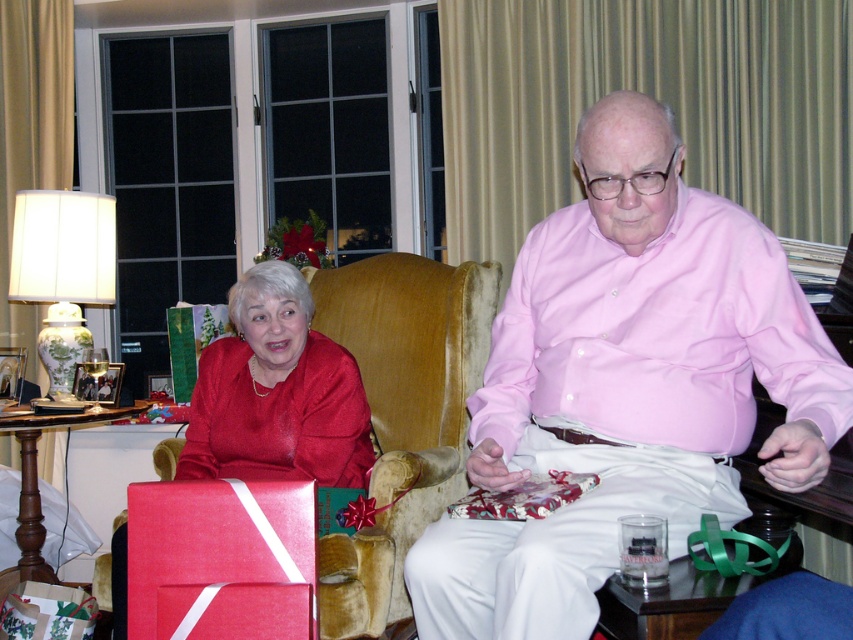
You are standing in the living room and want to place a small decoration between the two points labeled point (x=515, y=316) and point (x=341, y=352). Which point should you stand closer to ensure the decoration is centered between them?

To center the decoration between point (x=515, y=316) and point (x=341, y=352), you should stand closer to point (x=341, y=352) since it is farther from the viewer, balancing the distance.

You are standing in the living room and want to hand the pink cotton shirt at center to someone. Since you are 1.34 meters away from it, can you reach it without moving closer?

The pink cotton shirt at center is 1.34 meters away from the viewer. Since the average human arm length is about 0.7 meters, you cannot reach it without moving closer.